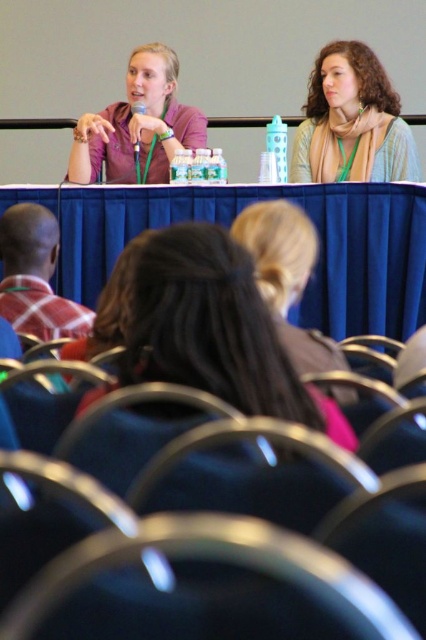
You are organizing a small event and need to place a 30 inch wide banner between the blue fabric table at center and the matte purple shirt at upper left. Based on the available space, will the banner fit without overlapping either object?

The distance between the blue fabric table at center and the matte purple shirt at upper left is 32.02 inches. Since the banner is 30 inches wide, it will fit within the space without overlapping either object.

You are standing in the conference room and want to walk towards the two points marked in the image. Which point, point (89, 342) or point (77, 128), will you reach first?

Point (89, 342) is closer to the viewer than point (77, 128), so you will reach point (89, 342) first.

You are an attendee trying to find your seat in the conference room. You see the blue fabric table at center and the matte purple shirt at upper left. Which one is located to the right of the other?

The blue fabric table at center is positioned on the right side of matte purple shirt at upper left.